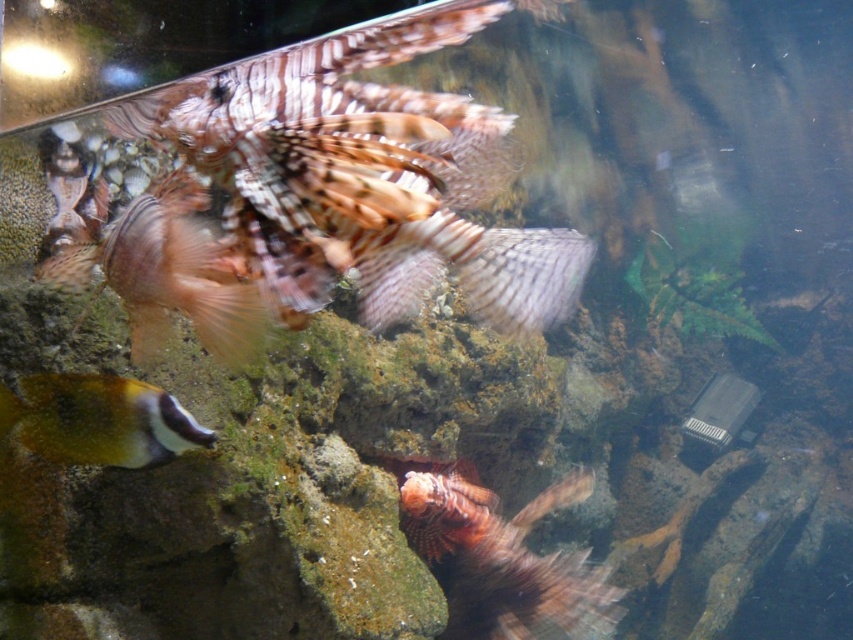
Between orange spiky fin at center and speckled yellow fish at lower left, which one is positioned higher?

speckled yellow fish at lower left

Describe the element at coordinates (503, 561) in the screenshot. I see `orange spiky fin at center` at that location.

This screenshot has width=853, height=640. Identify the location of orange spiky fin at center. (503, 561).

How much distance is there between multicolored feathery fish at upper left and speckled yellow fish at lower left?

19.91 centimeters

Does point (148, 342) lie behind point (138, 401)?

No.

What do you see at coordinates (169, 273) in the screenshot? This screenshot has width=853, height=640. I see `multicolored feathery fish at upper left` at bounding box center [169, 273].

Locate an element on the screen. This screenshot has width=853, height=640. multicolored feathery fish at upper left is located at coordinates (169, 273).

Is orange spiky fin at center shorter than multicolored feathery fish at upper left?

No, orange spiky fin at center is not shorter than multicolored feathery fish at upper left.

Is orange spiky fin at center positioned in front of multicolored feathery fish at upper left?

That is False.

Is point (598, 611) more distant than point (196, 296)?

Yes, point (598, 611) is farther from viewer.

Where is `orange spiky fin at center`? orange spiky fin at center is located at coordinates (503, 561).